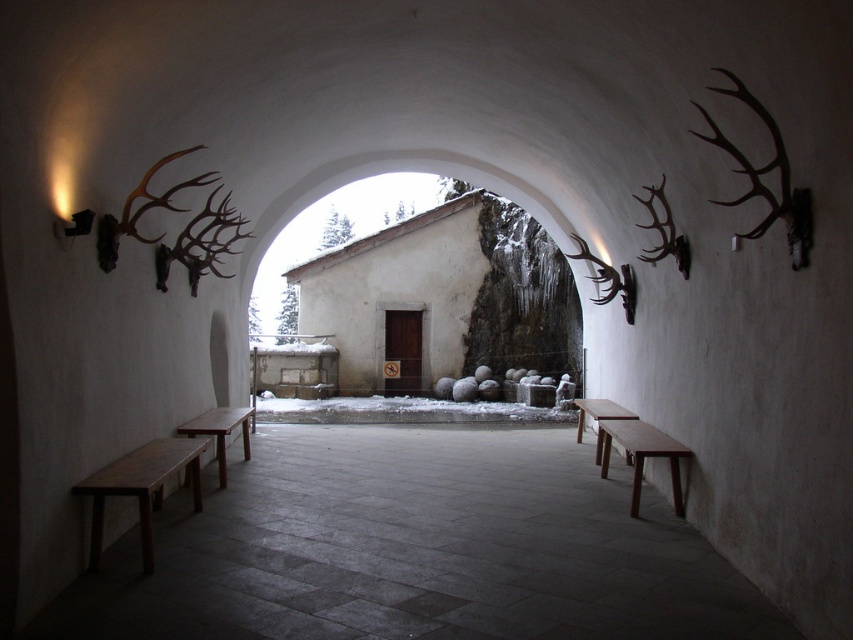
You are standing at the entrance of the arched passageway and see two smooth wooden benches in the courtyard. Which bench is closer to you, the smooth wooden bench at center or the smooth wooden bench at lower right?

The smooth wooden bench at center is closer to the viewer than the smooth wooden bench at lower right.